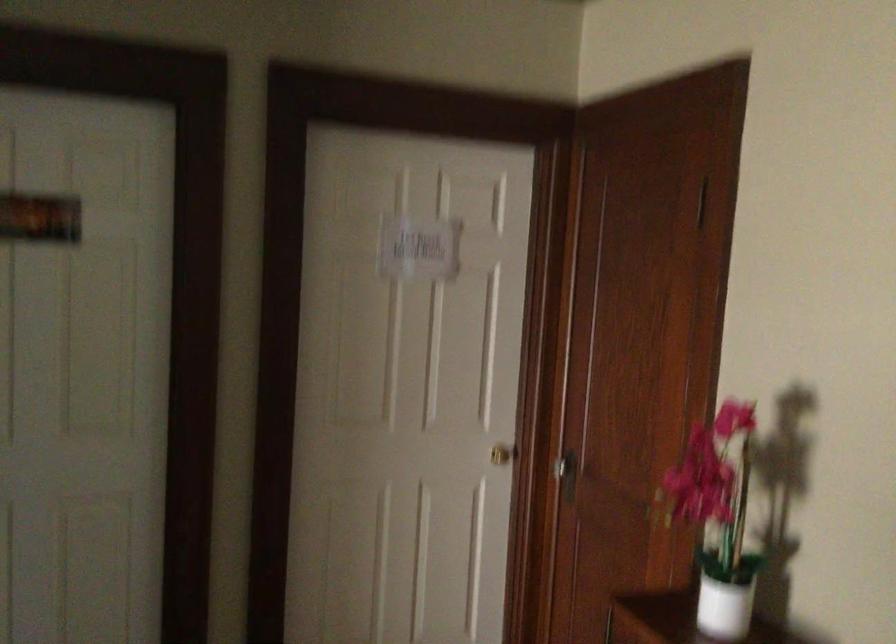
Where is `silver door handle`? silver door handle is located at coordinates (565, 471).